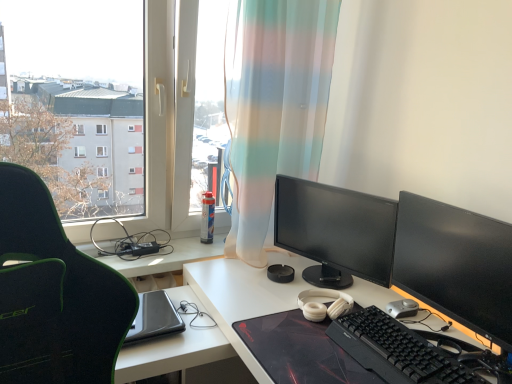
Image resolution: width=512 pixels, height=384 pixels. In order to click on empty space that is ontop of white matte desk at center in this screenshot , I will do `click(296, 305)`.